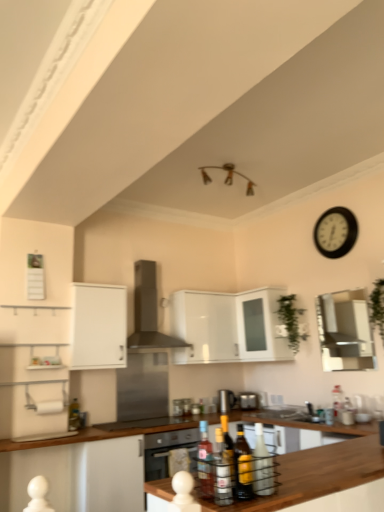
This screenshot has width=384, height=512. What do you see at coordinates (228, 326) in the screenshot? I see `white glossy cabinet at upper center, which is counted as the 1th cabinetry, starting from the right` at bounding box center [228, 326].

Image resolution: width=384 pixels, height=512 pixels. Describe the element at coordinates (226, 400) in the screenshot. I see `satin silver toaster at center, the 2th appliance viewed from the right` at that location.

Describe the element at coordinates (242, 466) in the screenshot. The width and height of the screenshot is (384, 512). I see `translucent glass bottle at center, placed as the second bottle when sorted from front to back` at that location.

In the scene shown: What is the approximate width of translucent glass bottle at center, the fourth bottle from the back?

It is 3.05 inches.

What is the approximate width of stainless steel range hood at center, acting as the first appliance starting from the left?

stainless steel range hood at center, acting as the first appliance starting from the left, is 24.87 inches wide.

Locate an element on the screen. The height and width of the screenshot is (512, 384). white glossy cabinet at upper center, the 2th cabinetry in the left-to-right sequence is located at coordinates (228, 326).

Is the depth of black plastic clock at upper right greater than that of satin silver toaster at center, placed as the 1th appliance when sorted from right to left?

No, it is in front of satin silver toaster at center, placed as the 1th appliance when sorted from right to left.

Is black plastic clock at upper right not near satin silver toaster at center, marked as the third appliance in a left-to-right arrangement?

Yes, black plastic clock at upper right is far from satin silver toaster at center, marked as the third appliance in a left-to-right arrangement.

Is black plastic clock at upper right taller than satin silver toaster at center, placed as the 1th appliance when sorted from right to left?

Indeed, black plastic clock at upper right has a greater height compared to satin silver toaster at center, placed as the 1th appliance when sorted from right to left.

From a real-world perspective, is black plastic clock at upper right positioned over satin silver toaster at center, marked as the third appliance in a left-to-right arrangement, based on gravity?

Indeed, from a real-world perspective, black plastic clock at upper right stands above satin silver toaster at center, marked as the third appliance in a left-to-right arrangement.

Looking at their sizes, would you say white glossy cabinet at upper center, which is counted as the 1th cabinetry, starting from the right, is wider or thinner than satin silver toaster at center, the 2th appliance viewed from the right?

In the image, white glossy cabinet at upper center, which is counted as the 1th cabinetry, starting from the right, appears to be wider than satin silver toaster at center, the 2th appliance viewed from the right.

Who is bigger, white glossy cabinet at upper center, which is counted as the 1th cabinetry, starting from the right, or satin silver toaster at center, which is counted as the second appliance, starting from the left?

Bigger between the two is white glossy cabinet at upper center, which is counted as the 1th cabinetry, starting from the right.

From a real-world perspective, is white glossy cabinet at upper center, which is counted as the 1th cabinetry, starting from the right, physically located above or below satin silver toaster at center, the 2th appliance viewed from the right?

In terms of real-world spatial position, white glossy cabinet at upper center, which is counted as the 1th cabinetry, starting from the right, is above satin silver toaster at center, the 2th appliance viewed from the right.

Is translucent glass bottle at center, placed as the fourth bottle when sorted from right to left, to the left of translucent glass bottle at lower left, acting as the first bottle starting from the back, from the viewer's perspective?

No, translucent glass bottle at center, placed as the fourth bottle when sorted from right to left, is not to the left of translucent glass bottle at lower left, acting as the first bottle starting from the back.

Based on the photo, can you confirm if translucent glass bottle at center, which ranks as the 2th bottle in left-to-right order, is thinner than translucent glass bottle at lower left, acting as the first bottle starting from the back?

Incorrect, the width of translucent glass bottle at center, which ranks as the 2th bottle in left-to-right order, is not less than that of translucent glass bottle at lower left, acting as the first bottle starting from the back.

Is translucent glass bottle at center, which appears as the second bottle when viewed from the back, positioned in front of translucent glass bottle at lower left, the 5th bottle in the right-to-left sequence?

Yes, it is in front of translucent glass bottle at lower left, the 5th bottle in the right-to-left sequence.

Is translucent glass bottle at center, which ranks as the 2th bottle in left-to-right order, positioned beyond the bounds of translucent glass bottle at lower left, the 5th bottle in the right-to-left sequence?

That's correct, translucent glass bottle at center, which ranks as the 2th bottle in left-to-right order, is outside of translucent glass bottle at lower left, the 5th bottle in the right-to-left sequence.

From a real-world perspective, is satin silver toaster at center, marked as the third appliance in a left-to-right arrangement, positioned above or below green leafy plant at right, which appears as the 2th plant when viewed from the back?

satin silver toaster at center, marked as the third appliance in a left-to-right arrangement, is situated lower than green leafy plant at right, which appears as the 2th plant when viewed from the back, in the real world.

Is satin silver toaster at center, placed as the 1th appliance when sorted from right to left, inside the boundaries of green leafy plant at right, which appears as the 2th plant when viewed from the back, or outside?

satin silver toaster at center, placed as the 1th appliance when sorted from right to left, is outside green leafy plant at right, which appears as the 2th plant when viewed from the back.

In terms of height, does satin silver toaster at center, placed as the 1th appliance when sorted from right to left, look taller or shorter compared to green leafy plant at right, the 2th plant when ordered from left to right?

satin silver toaster at center, placed as the 1th appliance when sorted from right to left, is shorter than green leafy plant at right, the 2th plant when ordered from left to right.

Locate an element on the screen. plant that is the 2nd object located in front of the satin silver toaster at center, placed as the 1th appliance when sorted from right to left is located at coordinates (377, 307).

Which is more to the left, green leafy plant at upper center, acting as the first plant starting from the left, or translucent glass bottle at center, which is the third bottle in front-to-back order?

translucent glass bottle at center, which is the third bottle in front-to-back order.

Locate an element on the screen. The width and height of the screenshot is (384, 512). the 1st bottle counting from the left side of the green leafy plant at upper center, positioned as the first plant in back-to-front order is located at coordinates (262, 465).

Is translucent glass bottle at center, the 1th bottle in the right-to-left sequence, located within green leafy plant at upper center, the 2th plant viewed from the front?

Definitely not — translucent glass bottle at center, the 1th bottle in the right-to-left sequence, is not inside green leafy plant at upper center, the 2th plant viewed from the front.

Looking at this image, can you confirm if green leafy plant at upper center, acting as the first plant starting from the left, is wider than translucent glass bottle at lower left, the first bottle viewed from the left?

Indeed, green leafy plant at upper center, acting as the first plant starting from the left, has a greater width compared to translucent glass bottle at lower left, the first bottle viewed from the left.

Between green leafy plant at upper center, acting as the first plant starting from the left, and translucent glass bottle at lower left, the 5th bottle in the right-to-left sequence, which one appears on the right side from the viewer's perspective?

Positioned to the right is green leafy plant at upper center, acting as the first plant starting from the left.

Is translucent glass bottle at lower left, the first bottle viewed from the left, located within green leafy plant at upper center, acting as the first plant starting from the left?

No, translucent glass bottle at lower left, the first bottle viewed from the left, is located outside of green leafy plant at upper center, acting as the first plant starting from the left.

Considering the relative sizes of green leafy plant at upper center, the 2th plant viewed from the front, and translucent glass bottle at lower left, the first bottle viewed from the left, in the image provided, is green leafy plant at upper center, the 2th plant viewed from the front, smaller than translucent glass bottle at lower left, the first bottle viewed from the left,?

No, green leafy plant at upper center, the 2th plant viewed from the front, is not smaller than translucent glass bottle at lower left, the first bottle viewed from the left.

Is stainless steel range hood at center, acting as the 3th appliance starting from the right, facing away from translucent glass bottle at center, marked as the fifth bottle in a left-to-right arrangement?

That's not correct — stainless steel range hood at center, acting as the 3th appliance starting from the right, is not looking away from translucent glass bottle at center, marked as the fifth bottle in a left-to-right arrangement.

From the image's perspective, is stainless steel range hood at center, acting as the 3th appliance starting from the right, on top of translucent glass bottle at center, the 1th bottle in the right-to-left sequence?

No, from the image's perspective, stainless steel range hood at center, acting as the 3th appliance starting from the right, is not above translucent glass bottle at center, the 1th bottle in the right-to-left sequence.

Considering the relative sizes of stainless steel range hood at center, acting as the 3th appliance starting from the right, and translucent glass bottle at center, which is the third bottle in front-to-back order, in the image provided, is stainless steel range hood at center, acting as the 3th appliance starting from the right, thinner than translucent glass bottle at center, which is the third bottle in front-to-back order,?

In fact, stainless steel range hood at center, acting as the 3th appliance starting from the right, might be wider than translucent glass bottle at center, which is the third bottle in front-to-back order.

From a real-world perspective, count 3rd appliances downward from the black plastic clock at upper right and point to it. Please provide its 2D coordinates.

[(248, 400)]

The width and height of the screenshot is (384, 512). I want to click on the 1st appliance to the left of the white glossy cabinet at upper center, the 2th cabinetry in the left-to-right sequence, starting your count from the anchor, so click(x=226, y=400).

From the image, which object appears to be nearer to stainless steel range hood at center, acting as the first appliance starting from the left, translucent glass bottles at center, positioned as the third bottle in left-to-right order, or translucent glass bottle at center, which appears as the second bottle when viewed from the back?

Among the two, translucent glass bottle at center, which appears as the second bottle when viewed from the back, is located nearer to stainless steel range hood at center, acting as the first appliance starting from the left.

From the picture: Looking at the image, which one is located closer to translucent glass bottle at center, which ranks as the 2th bottle in left-to-right order, translucent glass bottle at center, positioned as the 3th bottle in back-to-front order, or white glossy cabinet at upper center, which is counted as the 1th cabinetry, starting from the right?

Based on the image, white glossy cabinet at upper center, which is counted as the 1th cabinetry, starting from the right, appears to be nearer to translucent glass bottle at center, which ranks as the 2th bottle in left-to-right order.

When comparing their distances from green leafy plant at right, which appears as the 2th plant when viewed from the back, does satin silver toaster at center, which is counted as the second appliance, starting from the left, or green leafy plant at upper center, acting as the first plant starting from the left, seem further?

Among the two, satin silver toaster at center, which is counted as the second appliance, starting from the left, is located further to green leafy plant at right, which appears as the 2th plant when viewed from the back.

From the image, which object appears to be farther from translucent glass bottle at lower left, the 5th bottle positioned from the front, translucent glass bottle at center, which is counted as the second bottle, starting from the right, or translucent glass bottle at center, positioned as the 3th bottle in back-to-front order?

The object further to translucent glass bottle at lower left, the 5th bottle positioned from the front, is translucent glass bottle at center, which is counted as the second bottle, starting from the right.

Which object lies nearer to the anchor point translucent glass bottle at center, the 4th bottle in the left-to-right sequence, wooden at center, which is the first countertop from back to front, or green leafy plant at upper center, the 2th plant viewed from the front?

The object closer to translucent glass bottle at center, the 4th bottle in the left-to-right sequence, is wooden at center, which is the first countertop from back to front.

Based on their spatial positions, is stainless steel range hood at center, acting as the first appliance starting from the left, or green leafy plant at upper center, which is counted as the 2th plant, starting from the right, closer to white glossy cabinet at upper left, the second cabinetry positioned from the right?

stainless steel range hood at center, acting as the first appliance starting from the left.

Looking at the image, which one is located closer to black plastic clock at upper right, translucent glass bottle at center, positioned as the 3th bottle in back-to-front order, or wooden at center, the 2th countertop viewed from the back?

wooden at center, the 2th countertop viewed from the back, lies closer to black plastic clock at upper right than the other object.

From the image, which object appears to be farther from translucent glass bottles at center, which is the first bottle in front-to-back order, translucent glass bottle at center, which ranks as the 2th bottle in left-to-right order, or wooden at center, which is the first countertop from back to front?

The object further to translucent glass bottles at center, which is the first bottle in front-to-back order, is translucent glass bottle at center, which ranks as the 2th bottle in left-to-right order.

Find the location of a particular element. Image resolution: width=384 pixels, height=512 pixels. exhaust hood between wooden at center, which is the first countertop from front to back, and green leafy plant at upper center, the 2th plant viewed from the front, in the front-back direction is located at coordinates (148, 311).

Find the location of a particular element. This screenshot has width=384, height=512. countertop between translucent glass bottles at center, the fifth bottle viewed from the back, and wooden at center, the 2th countertop viewed from the back, in the up-down direction is located at coordinates (316, 475).

The image size is (384, 512). I want to click on exhaust hood between wooden at center, the 2th countertop viewed from the back, and satin silver toaster at center, marked as the third appliance in a left-to-right arrangement, in the front-back direction, so click(148, 311).

You are a GUI agent. You are given a task and a screenshot of the screen. Output one action in this format:
    pyautogui.click(x=<x>, y=<y>)
    Task: Click on the plant between wooden at center, the 2th countertop viewed from the back, and black plastic clock at upper right, along the z-axis
    
    Given the screenshot: What is the action you would take?
    pyautogui.click(x=377, y=307)